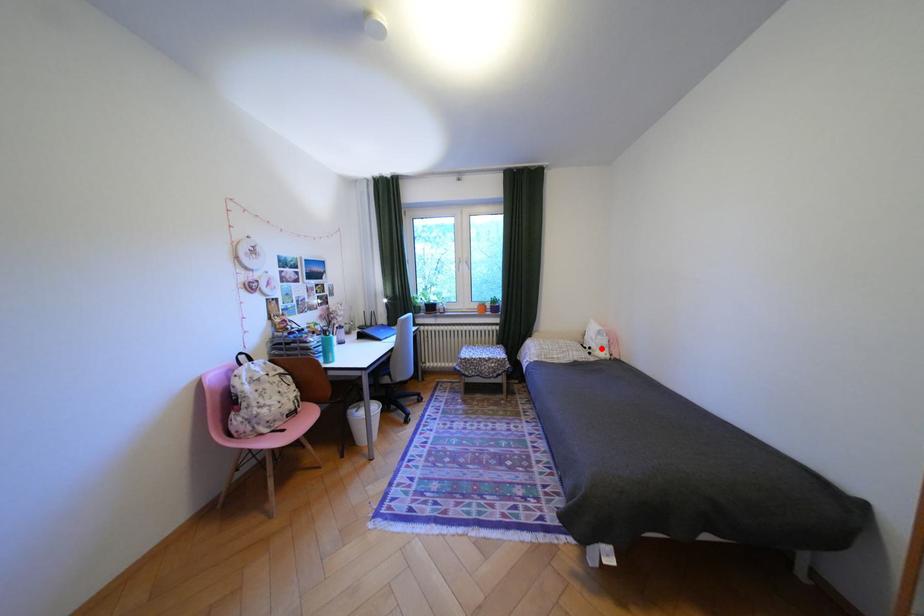
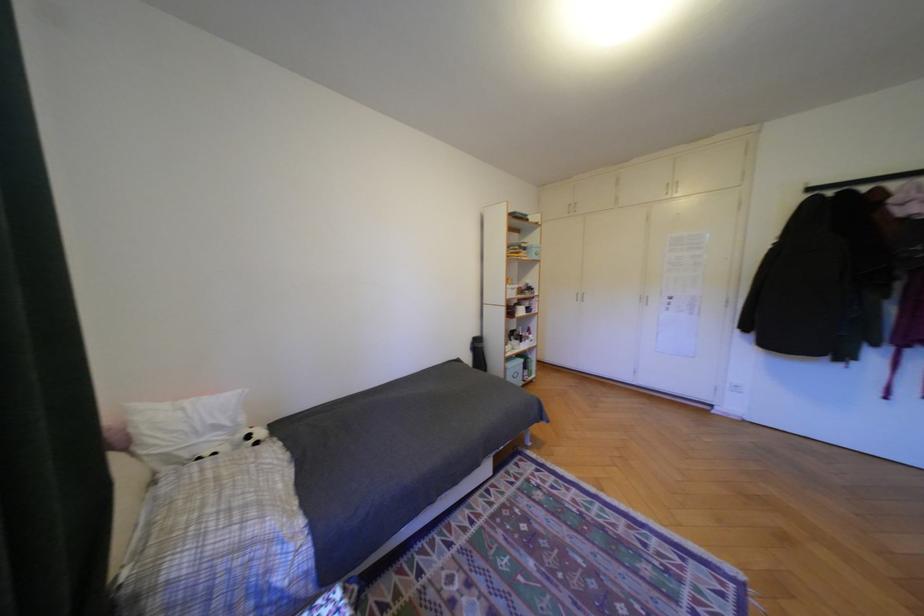
Question: A red point is marked in image1. In image2, is the corresponding 3D point closer to the camera or farther? Reply with the corresponding letter.

Choices:
 (A) The corresponding 3D point is closer.
 (B) The corresponding 3D point is farther.

Answer: (A)